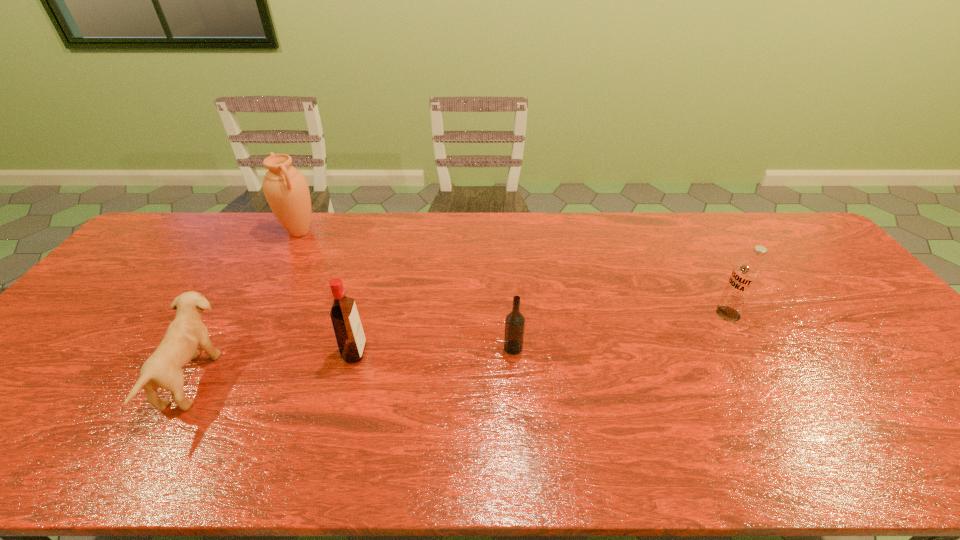
Image resolution: width=960 pixels, height=540 pixels. Identify the location of vacant space at the far left corner. coord(168,230).

This screenshot has width=960, height=540. Find the location of `vacant space at the far right corner of the desktop`. vacant space at the far right corner of the desktop is located at coordinates (774, 242).

Find the location of a particular element. The width and height of the screenshot is (960, 540). vacant area that lies between the third object from left to right and the shortest vodka is located at coordinates (434, 350).

Locate an element on the screen. The height and width of the screenshot is (540, 960). vacant space in between the shortest vodka and the third object from left to right is located at coordinates (434, 350).

Find the location of `vacant area that lies between the shortest vodka and the leftmost vodka`. vacant area that lies between the shortest vodka and the leftmost vodka is located at coordinates coord(434,350).

Find the location of a particular element. The width and height of the screenshot is (960, 540). empty location between the second vodka from left to right and the fourth nearest object is located at coordinates (621, 331).

What are the coordinates of `free area in between the third object from right to left and the second vodka from right to left` in the screenshot? It's located at (434, 350).

The height and width of the screenshot is (540, 960). Find the location of `vacant space in between the farthest vodka and the shortest vodka`. vacant space in between the farthest vodka and the shortest vodka is located at coordinates (621, 331).

At what (x,y) coordinates should I click in order to perform the action: click on blank region between the leftmost vodka and the fourth nearest object. Please return your answer as a coordinate pair (x, y). Looking at the image, I should click on pos(541,333).

The width and height of the screenshot is (960, 540). Find the location of `free space between the rightmost object and the third object from left to right`. free space between the rightmost object and the third object from left to right is located at coordinates (541, 333).